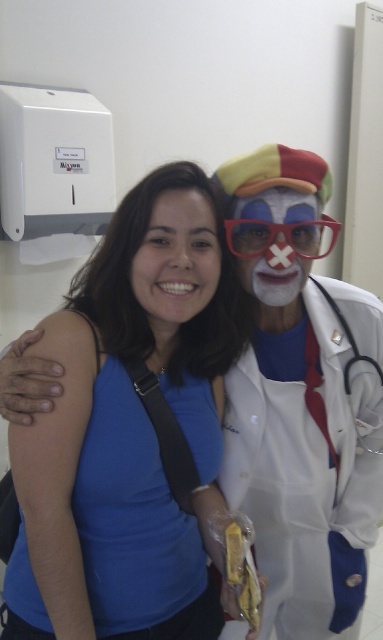
Question: Does blue matte shirt at center have a greater width compared to matte clown face at center?

Choices:
 (A) yes
 (B) no

Answer: (A)

Question: Does blue matte shirt at center appear under matte clown face at center?

Choices:
 (A) no
 (B) yes

Answer: (B)

Question: Can you confirm if blue matte shirt at center is bigger than matte clown face at center?

Choices:
 (A) no
 (B) yes

Answer: (B)

Question: Which point is closer to the camera?

Choices:
 (A) matte clown face at center
 (B) blue matte shirt at center
 (C) matte blue shirt at center

Answer: (B)

Question: Which object appears closest to the camera in this image?

Choices:
 (A) matte clown face at center
 (B) blue matte shirt at center
 (C) transparent plastic goggles at center

Answer: (B)

Question: Which object appears farthest from the camera in this image?

Choices:
 (A) matte blue shirt at center
 (B) blue matte shirt at center
 (C) transparent plastic goggles at center
 (D) matte clown face at center

Answer: (D)